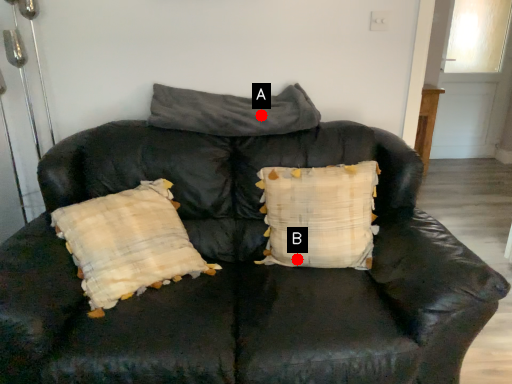
Question: Two points are circled on the image, labeled by A and B beside each circle. Among these points, which one is farthest from the camera?

Choices:
 (A) A is further
 (B) B is further

Answer: (A)